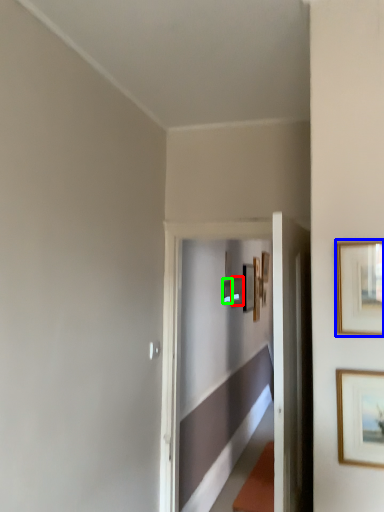
Question: Considering the real-world distances, which object is closest to picture frame (highlighted by a red box)? picture frame (highlighted by a blue box) or picture frame (highlighted by a green box).

Choices:
 (A) picture frame
 (B) picture frame

Answer: (B)